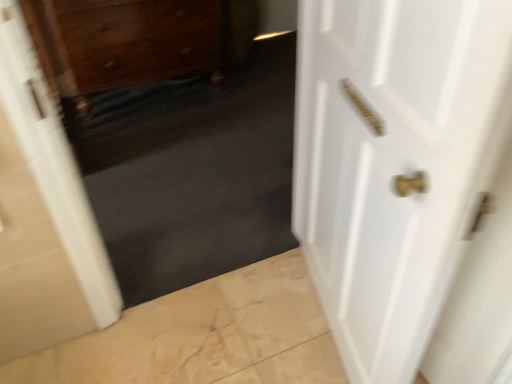
Find the location of a particular element. This screenshot has height=384, width=512. vacant region below dark matte carpet at center (from a real-world perspective) is located at coordinates (216, 269).